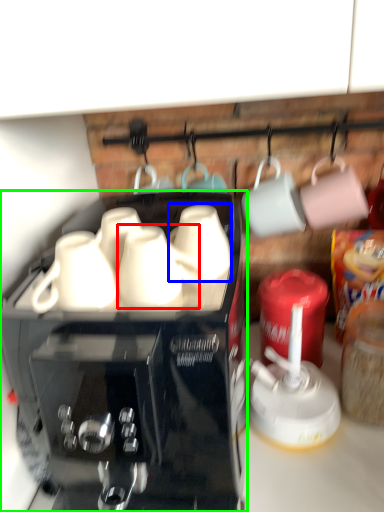
Question: Which object is positioned farthest from mug (highlighted by a red box)? Select from mug (highlighted by a blue box) and coffee maker (highlighted by a green box).

Choices:
 (A) mug
 (B) coffee maker

Answer: (B)